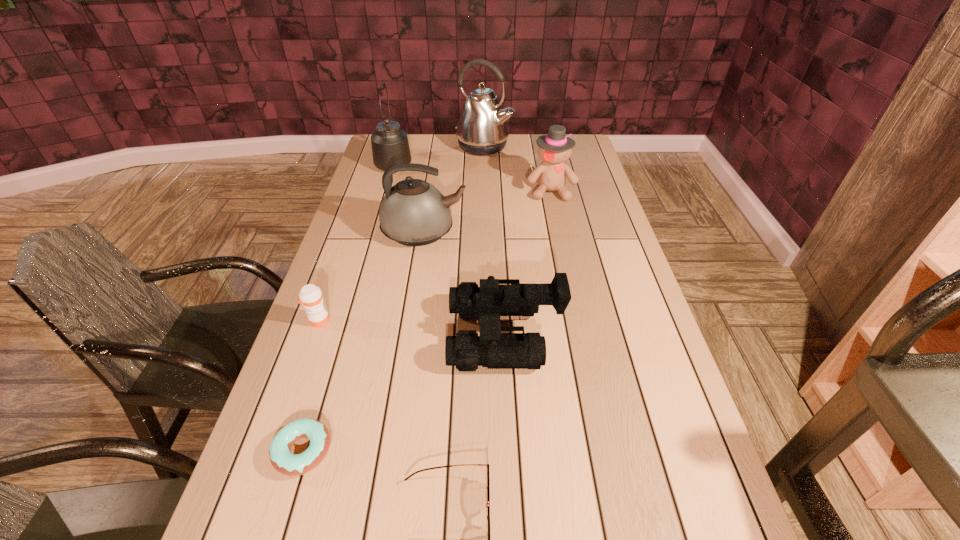
Where is `the nearest kettle`? Image resolution: width=960 pixels, height=540 pixels. the nearest kettle is located at coordinates tap(413, 212).

Identify the location of the shortest kettle. (413, 212).

At what (x,y) coordinates should I click in order to perform the action: click on rag_doll. Please return your answer as a coordinate pair (x, y). Looking at the image, I should click on (554, 149).

In order to click on binoculars in this screenshot , I will do coord(495,297).

Identify the location of the sixth tallest object. (310, 295).

Locate an element on the screen. The width and height of the screenshot is (960, 540). the shortest object is located at coordinates (285, 462).

Identify the location of vacant space positioned 0.050m at the spout of the nearest kettle. This screenshot has height=540, width=960. (483, 232).

Find the location of a particular element. blank space located 0.370m on the front-facing side of the third farthest object is located at coordinates (569, 275).

Where is `free region located on the front lenses of the binoculars`? free region located on the front lenses of the binoculars is located at coordinates (364, 335).

Find the location of `free point located 0.200m on the front lenses of the binoculars`. free point located 0.200m on the front lenses of the binoculars is located at coordinates (369, 335).